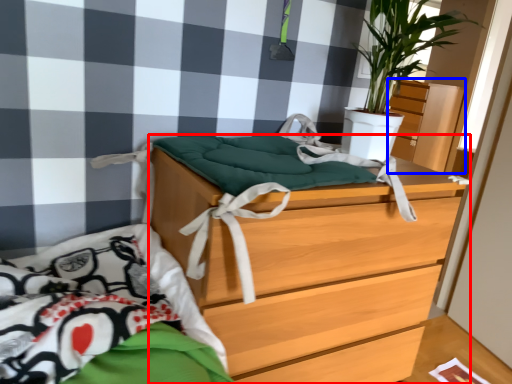
Question: Which point is further to the camera, chest of drawers (highlighted by a red box) or dresser (highlighted by a blue box)?

Choices:
 (A) chest of drawers
 (B) dresser

Answer: (B)